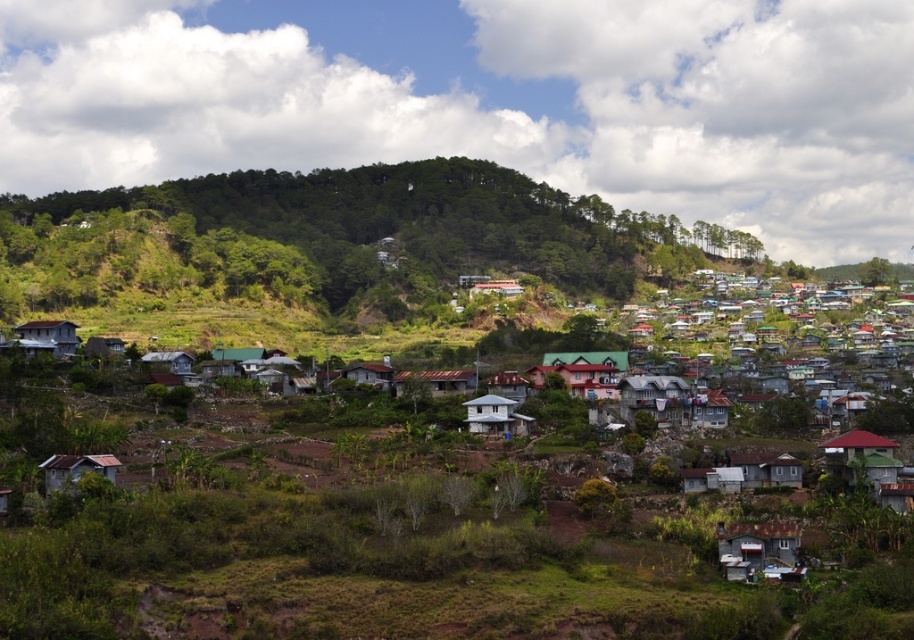
Question: Which of the following is the farthest from the observer?

Choices:
 (A) rusty corrugated metal hut at lower right
 (B) wooden shingle hut at lower left

Answer: (B)

Question: From the image, what is the correct spatial relationship of rusty corrugated metal hut at lower right in relation to white matte house at lower right?

Choices:
 (A) left
 (B) right

Answer: (A)

Question: Estimate the real-world distances between objects in this image. Which object is closer to the green matte hut at lower left?

Choices:
 (A) rustic wood cabin at center
 (B) rusty metal hut at center
 (C) white matte house at lower right

Answer: (B)

Question: Which of these objects is positioned farthest from the brown corrugated metal hut at center?

Choices:
 (A) rustic wood cabin at center
 (B) green matte house at lower right
 (C) matte red house at center
 (D) green matte hut at lower left

Answer: (B)

Question: Is matte red house at center closer to the viewer compared to wooden shingle hut at lower left?

Choices:
 (A) no
 (B) yes

Answer: (B)

Question: Can you confirm if matte red house at center is positioned to the left of rustic wood cabin at center?

Choices:
 (A) yes
 (B) no

Answer: (A)